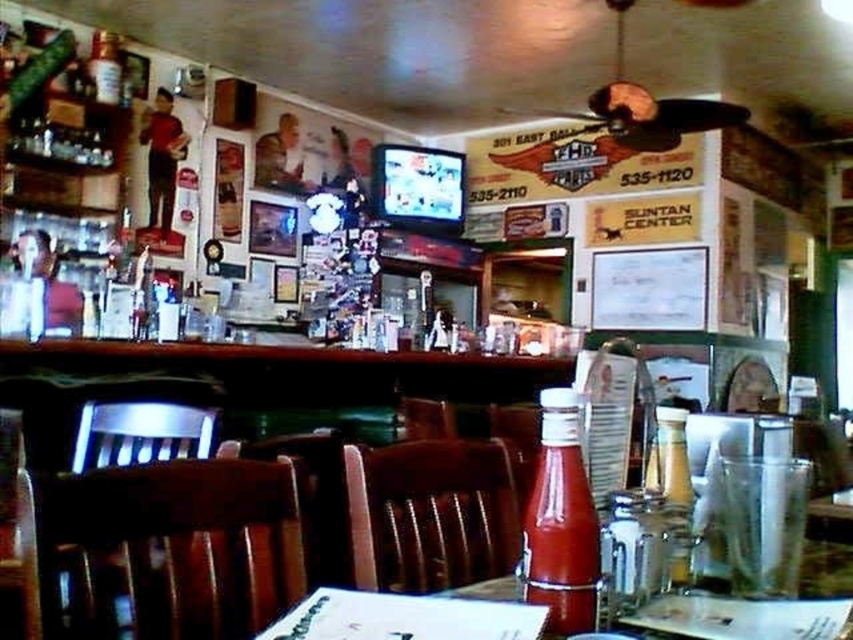
You are a delivery person carrying a large box that is 20 inches wide. You need to pass through the space between the brown leather chair at center and the clear glass bottle at center. Can your box fit through the space?

The brown leather chair at center might be wider than clear glass bottle at center, so the space between them may not be wide enough for a 20 inches wide box. You should check the actual width before proceeding.

You are a customer who just entered the diner and wants to sit down. You notice two chairs available at the table. Which chair, the brown wood chair at lower left or the brown leather chair at center, is shorter in height?

The brown wood chair at lower left is shorter in height compared to the brown leather chair at center.

Looking at this image, you are a person who is 1.7 meters tall and want to grab the clear glass bottle at center. The brown leather chair at center is blocking your path. Can you reach the bottle without moving the chair?

The brown leather chair at center is much taller as clear glass bottle at center, so the chair is at the same height as the bottle. Therefore, you can reach the bottle without moving the chair since they are at the same height.